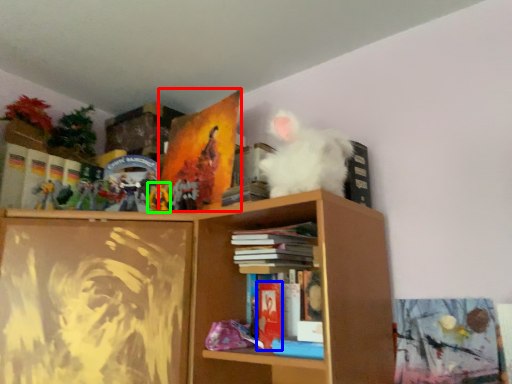
Question: Which is farther away from paperback book (highlighted by a red box)? paperback book (highlighted by a blue box) or toy (highlighted by a green box)?

Choices:
 (A) paperback book
 (B) toy

Answer: (A)